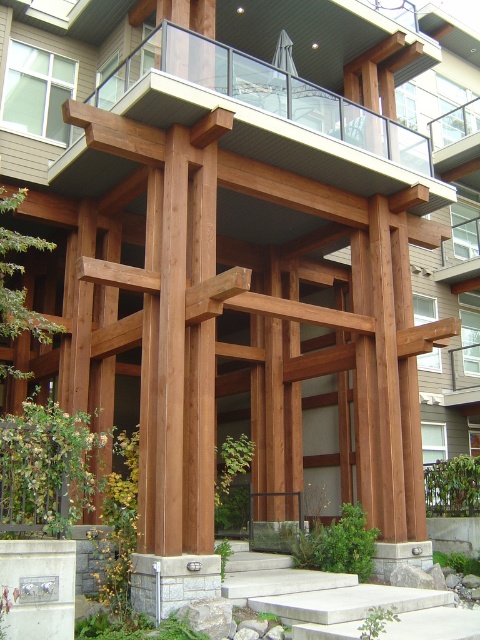
Question: Which point is closer to the camera?

Choices:
 (A) wooden balcony at upper center
 (B) concrete at center

Answer: (B)

Question: Can you confirm if wooden balcony at upper center is positioned below concrete at center?

Choices:
 (A) yes
 (B) no

Answer: (B)

Question: Which point is farther to the camera?

Choices:
 (A) concrete at center
 (B) wooden balcony at upper center

Answer: (B)

Question: Is wooden balcony at upper center to the left of concrete at center from the viewer's perspective?

Choices:
 (A) yes
 (B) no

Answer: (A)

Question: From the image, what is the correct spatial relationship of wooden balcony at upper center in relation to concrete at center?

Choices:
 (A) right
 (B) left

Answer: (B)

Question: Which point appears closest to the camera in this image?

Choices:
 (A) (244, 67)
 (B) (384, 630)

Answer: (B)